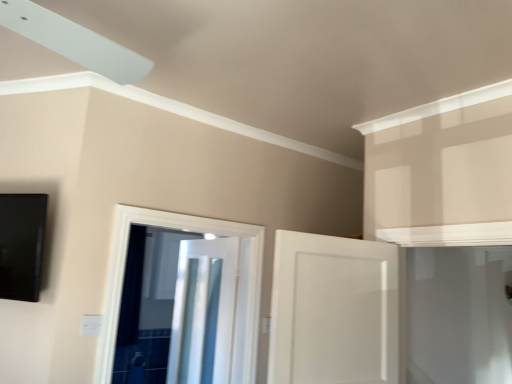
Question: In the image, is white glossy door at center, arranged as the third door when viewed from the back, positioned in front of or behind white glossy door at center, which is the second door from front to back?

Choices:
 (A) behind
 (B) front

Answer: (B)

Question: In the image, is white glossy door at center, positioned as the first door in front-to-back order, on the left side or the right side of white glossy door at center, which is the 2th door from back to front?

Choices:
 (A) right
 (B) left

Answer: (A)

Question: Estimate the real-world distances between objects in this image. Which object is farther from the white glossy door at center, positioned as the first door in front-to-back order?

Choices:
 (A) metallic silver door at center, the 3th door viewed from the front
 (B) white glossy door at center, which is the second door from front to back

Answer: (A)

Question: Which of these objects is positioned closest to the metallic silver door at center, the 3th door viewed from the front?

Choices:
 (A) white glossy door at center, which is the 2th door from back to front
 (B) white glossy door at center, positioned as the first door in front-to-back order

Answer: (A)